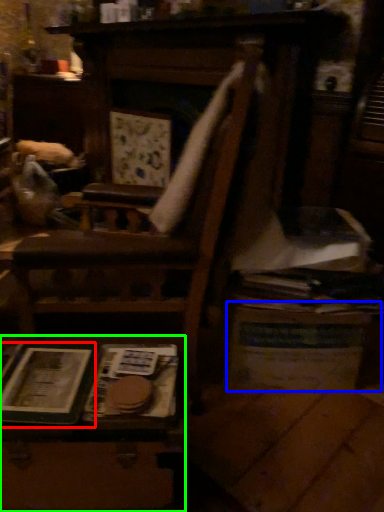
Question: Which is nearer to the paperback book (highlighted by a red box)? table (highlighted by a blue box) or table (highlighted by a green box).

Choices:
 (A) table
 (B) table

Answer: (B)